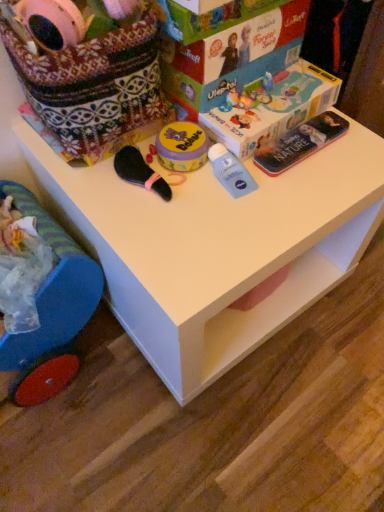
Image resolution: width=384 pixels, height=512 pixels. Describe the element at coordinates (216, 247) in the screenshot. I see `white plastic table at center` at that location.

What is the approximate height of blue plastic toy at lower left?

5.23 inches.

In order to face blue plastic toy at lower left, should I rotate leftwards or rightwards?

Turn left by 21.328 degrees to look at blue plastic toy at lower left.

What do you see at coordinates (300, 143) in the screenshot?
I see `matte plastic magazine at upper right` at bounding box center [300, 143].

You are a GUI agent. You are given a task and a screenshot of the screen. Output one action in this format:
    pyautogui.click(x=<x>, y=<y>)
    Task: Click on the white plastic table at center
    This screenshot has height=512, width=384.
    Given the screenshot: What is the action you would take?
    pyautogui.click(x=216, y=247)

Identify the location of storage box above the white plastic table at center (from a real-world perspective). This screenshot has height=512, width=384. (233, 55).

From the image's perspective, relative to white plastic table at center, is matte cardboard box at upper center above or below?

Clearly, from the image's perspective, matte cardboard box at upper center is above white plastic table at center.

Is point (254, 61) closer or farther from the camera than point (319, 182)?

Point (254, 61) is positioned farther from the camera compared to point (319, 182).

In the scene shown: Between matte cardboard box at upper center and white plastic table at center, which one is positioned behind?

matte cardboard box at upper center is behind.

Is white plastic table at center oriented away from matte plastic magazine at upper right?

No, white plastic table at center is not facing away from matte plastic magazine at upper right.

Considering the positions of objects white plastic table at center and matte plastic magazine at upper right in the image provided, who is more to the left, white plastic table at center or matte plastic magazine at upper right?

white plastic table at center is more to the left.

Which is behind, point (230, 347) or point (336, 133)?

The point (230, 347) is farther from the camera.

Identify the location of magazine behind the white plastic table at center. tap(300, 143).

From a real-world perspective, is matte plastic magazine at upper right beneath white plastic table at center?

Incorrect, from a real-world perspective, matte plastic magazine at upper right is higher than white plastic table at center.

From the image's perspective, which is above, matte plastic magazine at upper right or white plastic table at center?

matte plastic magazine at upper right, from the image's perspective.

Is matte plastic magazine at upper right oriented away from white plastic table at center?

matte plastic magazine at upper right does not have its back to white plastic table at center.

From a real-world perspective, is matte plastic magazine at upper right above or below matte cardboard box at upper center?

matte plastic magazine at upper right is situated lower than matte cardboard box at upper center in the real world.

Is matte plastic magazine at upper right far from matte cardboard box at upper center?

No, matte plastic magazine at upper right is not far away from matte cardboard box at upper center.

Can you confirm if matte plastic magazine at upper right is taller than matte cardboard box at upper center?

No.

Is matte plastic magazine at upper right positioned with its back to matte cardboard box at upper center?

No, matte plastic magazine at upper right is not facing the opposite direction of matte cardboard box at upper center.

What's the angular difference between blue plastic toy at lower left and white plastic table at center's facing directions?

There is a 80-degree angle between the facing directions of blue plastic toy at lower left and white plastic table at center.

Locate an element on the screen. toy behind the white plastic table at center is located at coordinates [51, 293].

In the image, is blue plastic toy at lower left positioned in front of or behind white plastic table at center?

In the image, blue plastic toy at lower left appears behind white plastic table at center.

How many degrees apart are the facing directions of matte cardboard box at upper center and blue plastic toy at lower left?

The angle between the facing direction of matte cardboard box at upper center and the facing direction of blue plastic toy at lower left is 80 degrees.

You are a GUI agent. You are given a task and a screenshot of the screen. Output one action in this format:
    pyautogui.click(x=<x>, y=<y>)
    Task: Click on the storage box behind the blue plastic toy at lower left
    Image resolution: width=384 pixels, height=512 pixels.
    Given the screenshot: What is the action you would take?
    pyautogui.click(x=233, y=55)

Based on the photo, is matte cardboard box at upper center smaller than blue plastic toy at lower left?

No, matte cardboard box at upper center is not smaller than blue plastic toy at lower left.

Which is farther, (220, 91) or (24, 346)?

The point (24, 346) is behind.

Is white plastic table at center taller or shorter than matte cardboard box at upper center?

white plastic table at center is taller than matte cardboard box at upper center.

Does white plastic table at center have a larger size compared to matte cardboard box at upper center?

Indeed, white plastic table at center has a larger size compared to matte cardboard box at upper center.

Is white plastic table at center in front of or behind matte cardboard box at upper center in the image?

white plastic table at center is positioned closer to the viewer than matte cardboard box at upper center.

Does point (120, 289) come behind point (250, 62)?

Yes, it is.

Find the location of a particular element. table that is under the matte cardboard box at upper center (from a real-world perspective) is located at coordinates (216, 247).

Where is `magazine on the right of white plastic table at center`? magazine on the right of white plastic table at center is located at coordinates (300, 143).

Looking at the image, which one is located closer to blue plastic toy at lower left, matte cardboard box at upper center or white plastic table at center?

Based on the image, white plastic table at center appears to be nearer to blue plastic toy at lower left.

When comparing their distances from matte plastic magazine at upper right, does white plastic table at center or matte cardboard box at upper center seem closer?

matte cardboard box at upper center is closer to matte plastic magazine at upper right.

When comparing their distances from matte plastic magazine at upper right, does matte cardboard box at upper center or blue plastic toy at lower left seem further?

The object further to matte plastic magazine at upper right is blue plastic toy at lower left.

Considering their positions, is matte plastic magazine at upper right positioned closer to matte cardboard box at upper center than white plastic table at center?

The object closer to matte cardboard box at upper center is matte plastic magazine at upper right.

Which object lies nearer to the anchor point matte plastic magazine at upper right, white plastic table at center or blue plastic toy at lower left?

white plastic table at center is closer to matte plastic magazine at upper right.

From the image, which object appears to be nearer to white plastic table at center, matte plastic magazine at upper right or matte cardboard box at upper center?

Among the two, matte plastic magazine at upper right is located nearer to white plastic table at center.

Estimate the real-world distances between objects in this image. Which object is further from matte cardboard box at upper center, white plastic table at center or blue plastic toy at lower left?

blue plastic toy at lower left lies further to matte cardboard box at upper center than the other object.

From the image, which object appears to be farther from matte cardboard box at upper center, blue plastic toy at lower left or white plastic table at center?

The object further to matte cardboard box at upper center is blue plastic toy at lower left.

The image size is (384, 512). Find the location of `table between blue plastic toy at lower left and matte plastic magazine at upper right from left to right`. table between blue plastic toy at lower left and matte plastic magazine at upper right from left to right is located at coordinates (216, 247).

You are a GUI agent. You are given a task and a screenshot of the screen. Output one action in this format:
    pyautogui.click(x=<x>, y=<y>)
    Task: Click on the storage box between blue plastic toy at lower left and matte plastic magazine at upper right in the horizontal direction
    Image resolution: width=384 pixels, height=512 pixels.
    Given the screenshot: What is the action you would take?
    pyautogui.click(x=233, y=55)

Where is `magazine between matte cardboard box at upper center and white plastic table at center from top to bottom`? magazine between matte cardboard box at upper center and white plastic table at center from top to bottom is located at coordinates (300, 143).

You are a GUI agent. You are given a task and a screenshot of the screen. Output one action in this format:
    pyautogui.click(x=<x>, y=<y>)
    Task: Click on the table between matte cardboard box at upper center and blue plastic toy at lower left in the vertical direction
    The image size is (384, 512).
    Given the screenshot: What is the action you would take?
    click(216, 247)